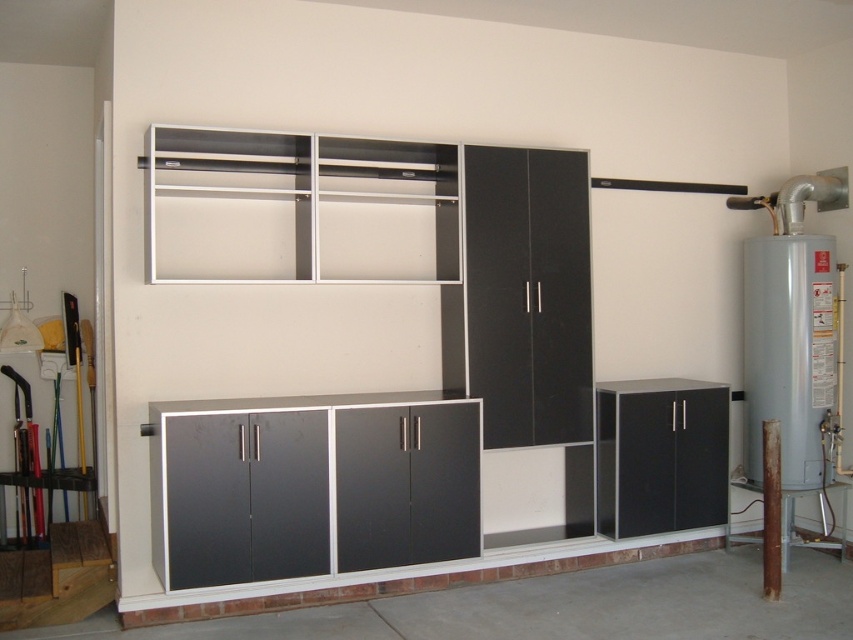
Is white matte shelf at upper center wider than matte black cabinet at lower right?

Yes, white matte shelf at upper center is wider than matte black cabinet at lower right.

This screenshot has height=640, width=853. I want to click on white matte shelf at upper center, so coord(300,208).

In order to click on white matte shelf at upper center in this screenshot , I will do `click(300, 208)`.